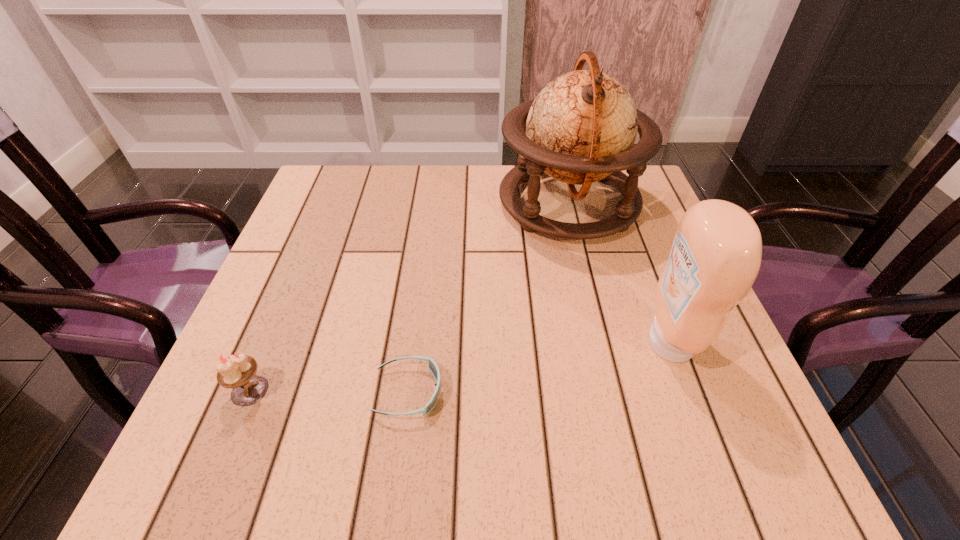
Identify the location of globe. The height and width of the screenshot is (540, 960). (581, 128).

Where is `the tallest object`? the tallest object is located at coordinates 581,128.

What are the coordinates of `condiment` in the screenshot? It's located at (716, 254).

Locate an element on the screen. The image size is (960, 540). the leftmost object is located at coordinates (235, 371).

I want to click on the third tallest object, so click(235, 371).

Find the location of a particular element. the second object from left to right is located at coordinates (432, 366).

You are a GUI agent. You are given a task and a screenshot of the screen. Output one action in this format:
    pyautogui.click(x=<x>, y=<y>)
    Task: Click on the goggles
    
    Given the screenshot: What is the action you would take?
    (x=432, y=366)

This screenshot has height=540, width=960. Identify the location of vacant region located on the front of the tallest object. (610, 375).

This screenshot has width=960, height=540. Find the location of `free location located on the label of the condiment`. free location located on the label of the condiment is located at coordinates (557, 342).

Locate an element on the screen. The image size is (960, 540). free space located 0.280m on the label of the condiment is located at coordinates (491, 342).